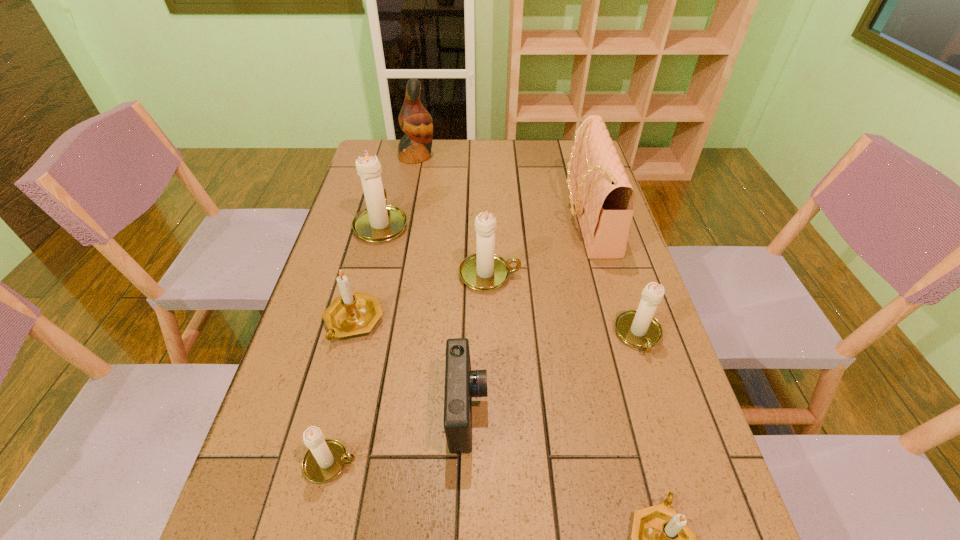
Locate an element on the screen. The image size is (960, 540). object that is positioned at the far left corner is located at coordinates (415, 121).

Where is `free spot at the far edge of the desktop`? free spot at the far edge of the desktop is located at coordinates (512, 140).

Locate an element on the screen. The image size is (960, 540). vacant space at the right edge of the desktop is located at coordinates (655, 315).

Where is `vacant area at the far left corner`? Image resolution: width=960 pixels, height=540 pixels. vacant area at the far left corner is located at coordinates (390, 154).

You are a GUI agent. You are given a task and a screenshot of the screen. Output one action in this format:
    pyautogui.click(x=<x>, y=<y>)
    Task: Click on the vacant area between the second biggest white candle holder and the farthest candle holder
    The height and width of the screenshot is (540, 960).
    Given the screenshot: What is the action you would take?
    pyautogui.click(x=436, y=249)

I want to click on vacant space that's between the camera and the pink handbag, so coord(527,314).

Identify the location of free space that is in between the blue camera and the left gold candle holder. (410, 366).

At what (x,y) coordinates should I click in order to perform the action: click on vacant space that's between the parrot and the second farthest white candle holder. Please return your answer as a coordinate pair (x, y). Image resolution: width=960 pixels, height=540 pixels. Looking at the image, I should click on (453, 215).

Identify which object is the fourth closest to the blue camera. Please provide its 2D coordinates. Your answer should be formatted as a tuple, i.e. [(x, y)], where the tuple contains the x and y coordinates of a point satisfying the conditions above.

[(661, 539)]

Identify which object is the fifth closest to the nearer gold candle holder. Please provide its 2D coordinates. Your answer should be formatted as a tuple, i.e. [(x, y)], where the tuple contains the x and y coordinates of a point satisfying the conditions above.

[(355, 313)]